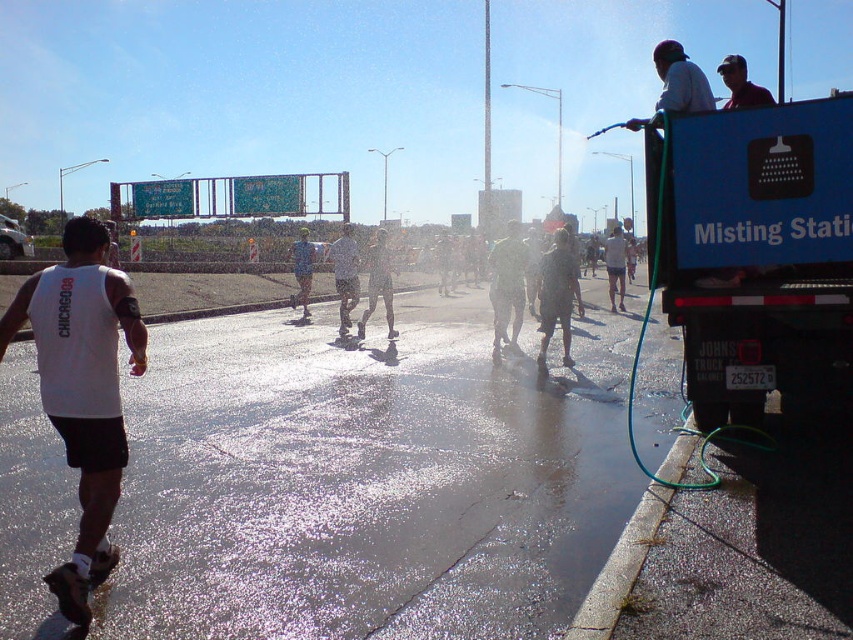
Question: Among these objects, which one is nearest to the camera?

Choices:
 (A) matte black shorts at center
 (B) blue plastic truck at right
 (C) matte black shirt at upper right

Answer: (B)

Question: Does blue plastic truck at right have a greater width compared to camouflage shorts at center?

Choices:
 (A) no
 (B) yes

Answer: (B)

Question: Does matte black shorts at center have a larger size compared to white matte shorts at center?

Choices:
 (A) yes
 (B) no

Answer: (B)

Question: Among these objects, which one is nearest to the camera?

Choices:
 (A) white matte shorts at center
 (B) white matte tank top at left
 (C) camouflage shorts at center

Answer: (B)

Question: Is white matte tank top at left thinner than matte black shirt at upper right?

Choices:
 (A) yes
 (B) no

Answer: (A)

Question: Estimate the real-world distances between objects in this image. Which object is farther from the white matte tank top at left?

Choices:
 (A) camouflage shorts at center
 (B) green camouflage pants at center
 (C) matte black shorts at center
 (D) white matte shorts at center

Answer: (D)